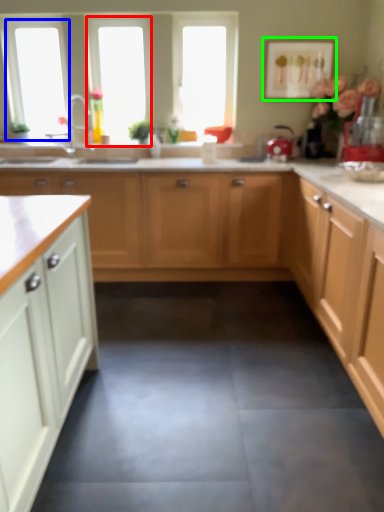
Question: Which is farther away from window (highlighted by a red box)? window screen (highlighted by a blue box) or picture frame (highlighted by a green box)?

Choices:
 (A) window screen
 (B) picture frame

Answer: (B)